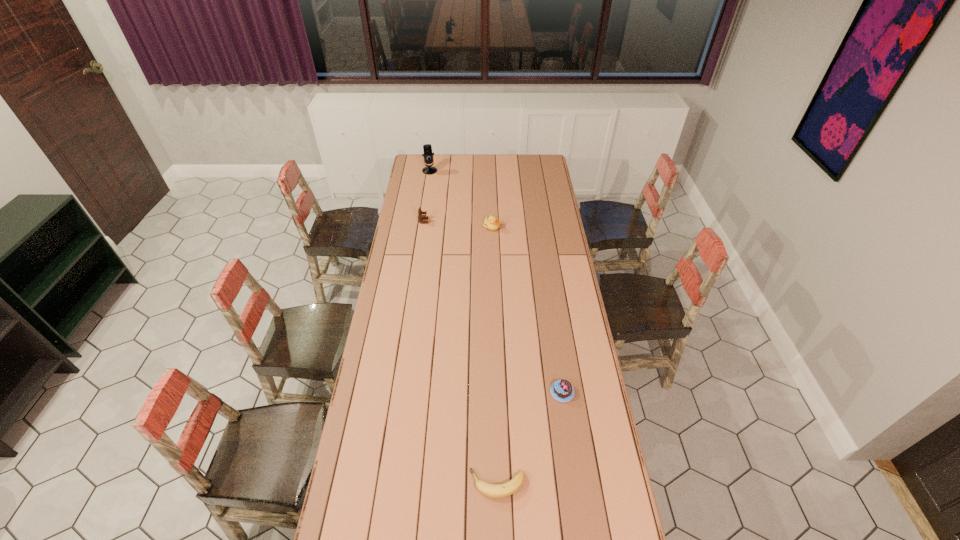
Where is `free space between the teddy bear and the fourth farthest object`? The image size is (960, 540). free space between the teddy bear and the fourth farthest object is located at coordinates (492, 307).

The image size is (960, 540). I want to click on unoccupied position between the second nearest object and the duckling, so click(x=527, y=309).

Identify the location of free point between the nearest object and the duckling. The height and width of the screenshot is (540, 960). (494, 355).

Locate an element on the screen. vacant point located between the tallest object and the rightmost object is located at coordinates (496, 281).

The width and height of the screenshot is (960, 540). Find the location of `unoccupied position between the duckling and the teddy bear`. unoccupied position between the duckling and the teddy bear is located at coordinates (458, 224).

Point out which object is positioned as the nearest to the duckling. Please provide its 2D coordinates. Your answer should be formatted as a tuple, i.e. [(x, y)], where the tuple contains the x and y coordinates of a point satisfying the conditions above.

[(420, 217)]

Identify which object is located as the third nearest to the teddy bear. Please provide its 2D coordinates. Your answer should be formatted as a tuple, i.e. [(x, y)], where the tuple contains the x and y coordinates of a point satisfying the conditions above.

[(562, 390)]

In order to click on free point that satisfies the following two spatial constraints: 1. on the face of the teddy bear; 2. on the back side of the rightmost object in this screenshot , I will do (x=398, y=392).

Identify the location of free space that satisfies the following two spatial constraints: 1. on the face of the teddy bear; 2. on the right side of the chocolate cake. (398, 392).

The height and width of the screenshot is (540, 960). I want to click on vacant area in the image that satisfies the following two spatial constraints: 1. on the face of the fourth tallest object; 2. on the left side of the teddy bear, so [398, 392].